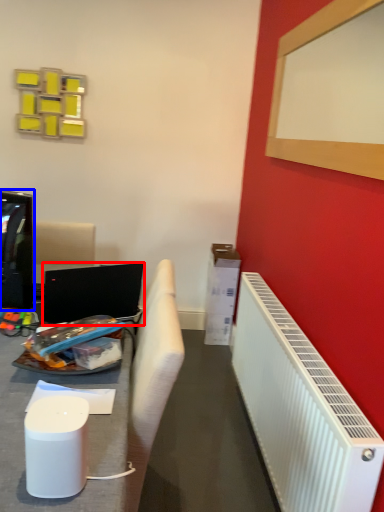
Question: Which object is further to the camera taking this photo, laptop (highlighted by a red box) or television (highlighted by a blue box)?

Choices:
 (A) laptop
 (B) television

Answer: (A)